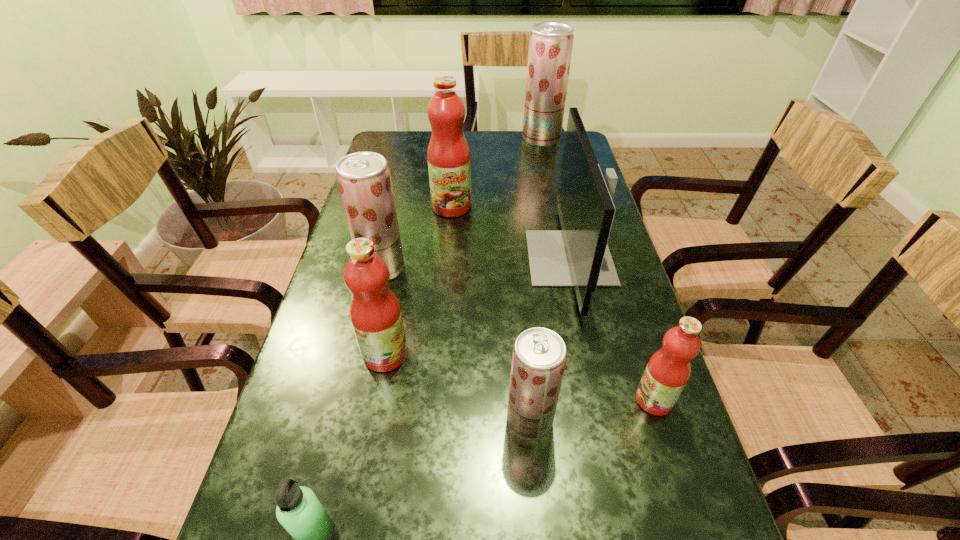
The width and height of the screenshot is (960, 540). In order to click on free space located on the left of the smallest strawberry fruit juice in this screenshot , I will do tap(389, 421).

Image resolution: width=960 pixels, height=540 pixels. Identify the location of vacant space located 0.080m on the front label of the nearest pink fruit juice. (594, 400).

Locate an element on the screen. The image size is (960, 540). blank space located on the front label of the nearest pink fruit juice is located at coordinates (610, 400).

Image resolution: width=960 pixels, height=540 pixels. I want to click on free space located 0.200m on the front label of the nearest pink fruit juice, so click(x=533, y=400).

Locate an element on the screen. object that is at the far edge is located at coordinates (550, 48).

Image resolution: width=960 pixels, height=540 pixels. I want to click on computer monitor situated at the right edge, so click(578, 255).

Identify the location of object at the far right corner. This screenshot has height=540, width=960. (550, 48).

In the image, there is a desktop. Identify the location of blank space at the left edge. click(x=315, y=423).

This screenshot has height=540, width=960. I want to click on vacant space at the right edge of the desktop, so click(x=632, y=408).

The width and height of the screenshot is (960, 540). Identify the location of vacant space at the far left corner of the desktop. (396, 156).